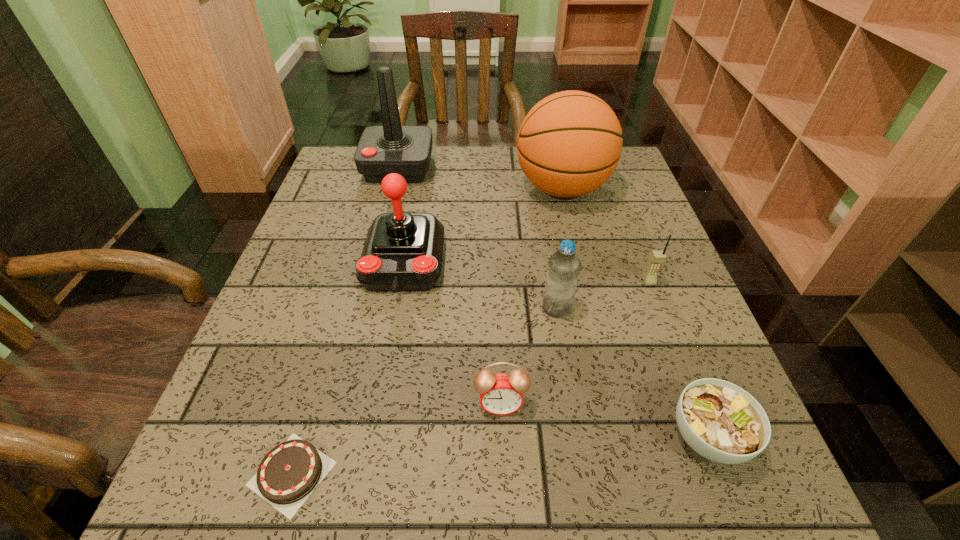
Locate an element on the screen. the taller joystick is located at coordinates (406, 150).

Where is `basketball`? The image size is (960, 540). basketball is located at coordinates (569, 144).

Find the location of a particular element. the shorter joystick is located at coordinates (402, 252).

Where is `the sixth shortest object`? the sixth shortest object is located at coordinates (402, 252).

The image size is (960, 540). What are the coordinates of `the fifth shortest object` in the screenshot? It's located at (564, 265).

The height and width of the screenshot is (540, 960). I want to click on cellular telephone, so click(657, 257).

Identify the location of alarm clock. (501, 394).

Where is `the third shortest object`? the third shortest object is located at coordinates (501, 394).

Locate an element on the screen. The width and height of the screenshot is (960, 540). the second shortest object is located at coordinates (722, 422).

The image size is (960, 540). Identify the location of the shortest object. (288, 474).